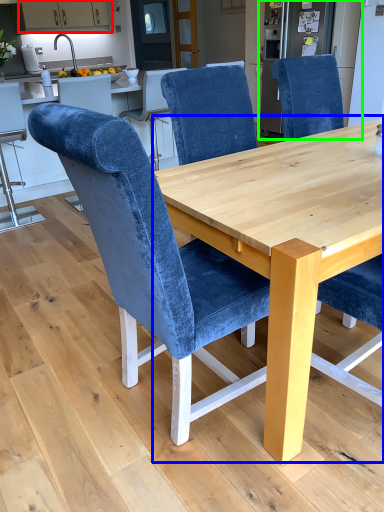
Question: Which is farther away from cabinetry (highlighted by a red box)? round table (highlighted by a blue box) or appliance (highlighted by a green box)?

Choices:
 (A) round table
 (B) appliance

Answer: (A)